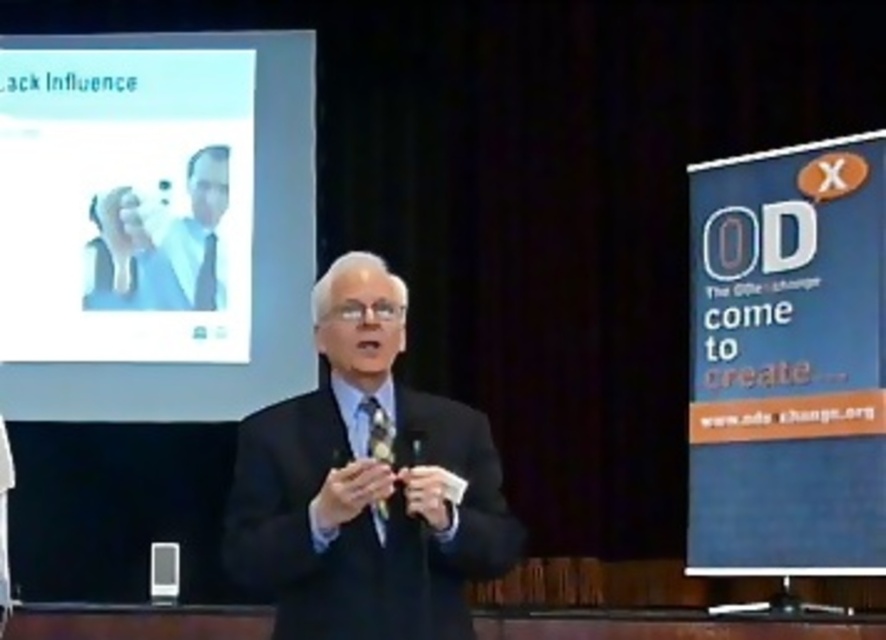
Consider the image. Which is above, white glossy projector screen at upper left or light blue suit at upper left?

white glossy projector screen at upper left

Based on the photo, between white glossy projector screen at upper left and light blue suit at upper left, which one is positioned lower?

Positioned lower is light blue suit at upper left.

Who is more forward, (109, 97) or (134, 294)?

Positioned in front is point (134, 294).

Image resolution: width=886 pixels, height=640 pixels. I want to click on white glossy projector screen at upper left, so click(154, 224).

Does blue paper at right have a smaller size compared to matte black tie at center?

No, blue paper at right is not smaller than matte black tie at center.

Who is more forward, (x=833, y=502) or (x=204, y=282)?

Point (x=833, y=502) is in front.

This screenshot has width=886, height=640. I want to click on blue paper at right, so coord(789,360).

Can you confirm if light blue suit at upper left is positioned below matte black tie at center?

No.

Who is taller, light blue suit at upper left or matte black tie at center?

With more height is light blue suit at upper left.

The image size is (886, 640). What are the coordinates of `light blue suit at upper left` in the screenshot? It's located at (162, 244).